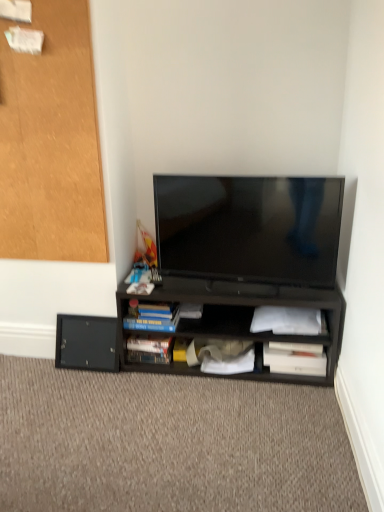
Find the location of a particular element. free spot to the left of white paper at lower right, which is the first paperback book in right-to-left order is located at coordinates (252, 384).